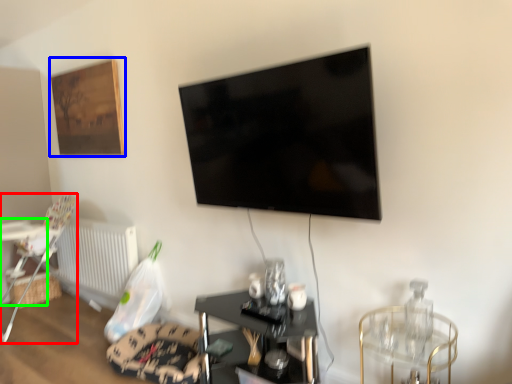
Question: Which object is the closest to the chair (highlighted by a red box)? Choose among these: picture frame (highlighted by a blue box) or table (highlighted by a green box).

Choices:
 (A) picture frame
 (B) table

Answer: (B)